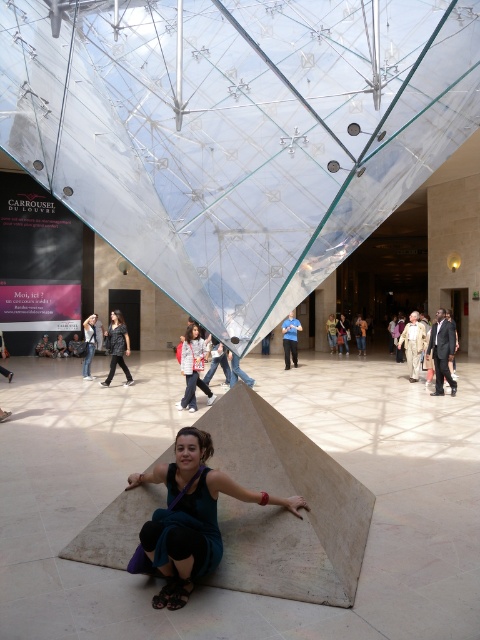
Does teal fabric dress at center appear over white shirt at center?

No, teal fabric dress at center is not above white shirt at center.

Is teal fabric dress at center wider than white shirt at center?

Indeed, teal fabric dress at center has a greater width compared to white shirt at center.

Is point (179, 460) farther from camera compared to point (190, 376)?

No.

Find the location of a particular element. The height and width of the screenshot is (640, 480). teal fabric dress at center is located at coordinates (192, 515).

Between point (119, 356) and point (286, 321), which one is positioned behind?

The point (286, 321) is more distant.

Looking at this image, can you confirm if leather jacket at center is bigger than blue shirt at center?

Incorrect, leather jacket at center is not larger than blue shirt at center.

Is point (122, 348) in front of point (282, 324)?

Yes, it is in front of point (282, 324).

Locate an element on the screen. leather jacket at center is located at coordinates (118, 346).

Is white shirt at center positioned before leather jacket at center?

Yes, it is in front of leather jacket at center.

Is point (191, 333) less distant than point (109, 337)?

Yes.

What do you see at coordinates (192, 369) in the screenshot? I see `white shirt at center` at bounding box center [192, 369].

This screenshot has width=480, height=640. I want to click on white shirt at center, so click(x=192, y=369).